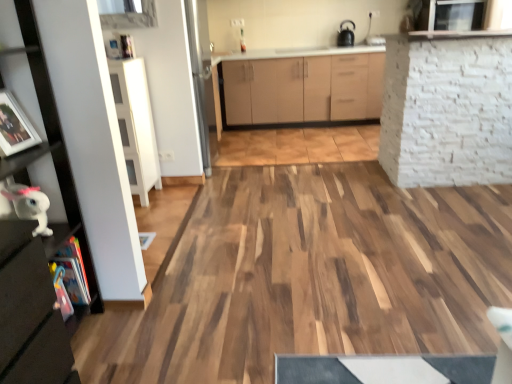
Question: Is white brick wall at upper right bigger or smaller than white glossy sink at upper center?

Choices:
 (A) small
 (B) big

Answer: (B)

Question: Which is correct: white brick wall at upper right is inside white glossy sink at upper center, or outside of it?

Choices:
 (A) outside
 (B) inside

Answer: (A)

Question: Which is farther from the white glossy plush toy at lower left?

Choices:
 (A) white brick wall at upper right
 (B) white glossy sink at upper center
 (C) black matte kettle at upper center
 (D) matte black shelf at left, the 2th cabinetry viewed from the right
 (E) matte white picture frame at left

Answer: (C)

Question: Which object is the closest to the white brick wall at upper right?

Choices:
 (A) white glossy plush toy at lower left
 (B) matte black shelf at left, positioned as the 1th cabinetry in left-to-right order
 (C) matte white picture frame at left
 (D) black matte kettle at upper center
 (E) white glossy sink at upper center

Answer: (B)